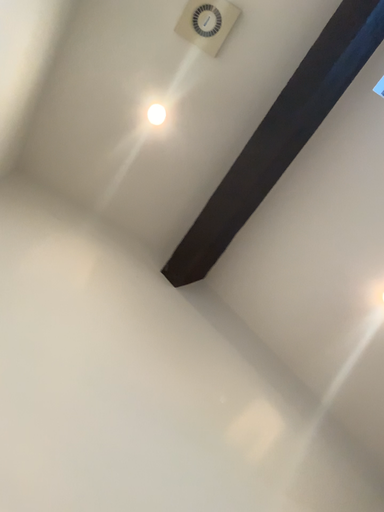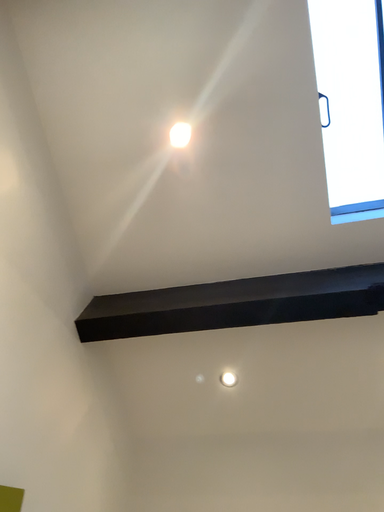
Question: How did the camera likely rotate when shooting the video?

Choices:
 (A) rotated downward
 (B) rotated upward

Answer: (A)